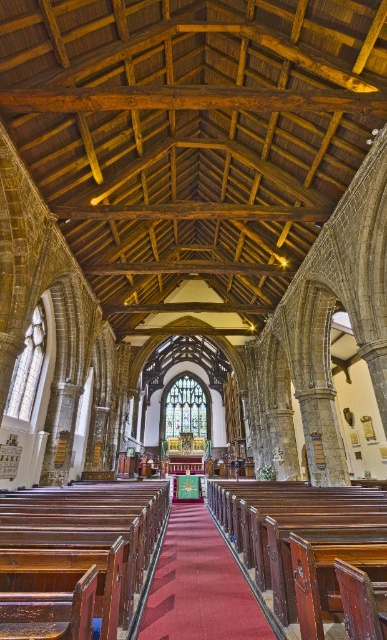
You are standing at the entrance of the church and see the point marked as point (85, 544). What object is located at that point?

The polished wood church bench at center is located at point (85, 544).